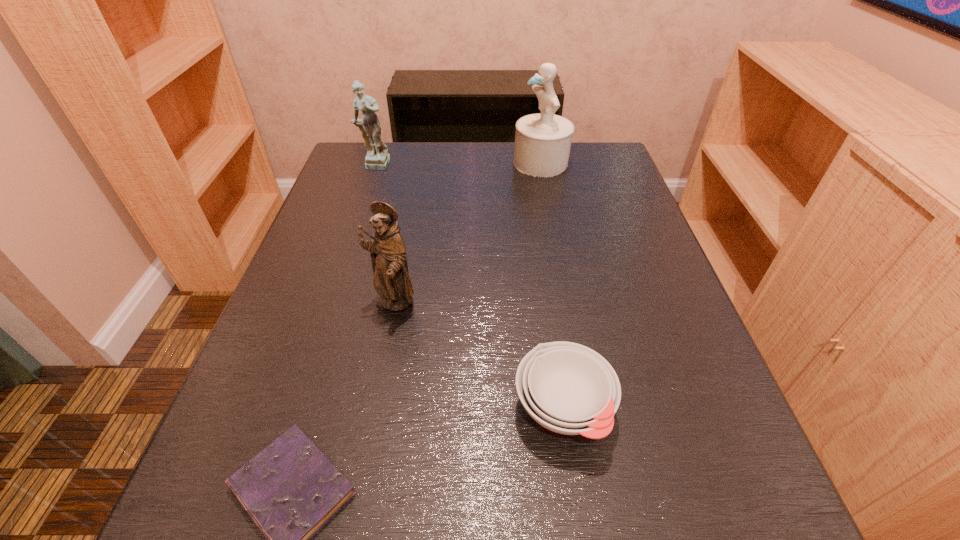
The width and height of the screenshot is (960, 540). In order to click on vacant space that satisfies the following two spatial constraints: 1. on the front-facing side of the third farthest object; 2. on the right side of the soup bowl in this screenshot , I will do `click(373, 409)`.

At what (x,y) coordinates should I click in order to perform the action: click on vacant space that satisfies the following two spatial constraints: 1. at the beak of the rightmost figurine; 2. on the front-facing side of the leftmost figurine. Please return your answer as a coordinate pair (x, y). This screenshot has width=960, height=540. Looking at the image, I should click on (541, 166).